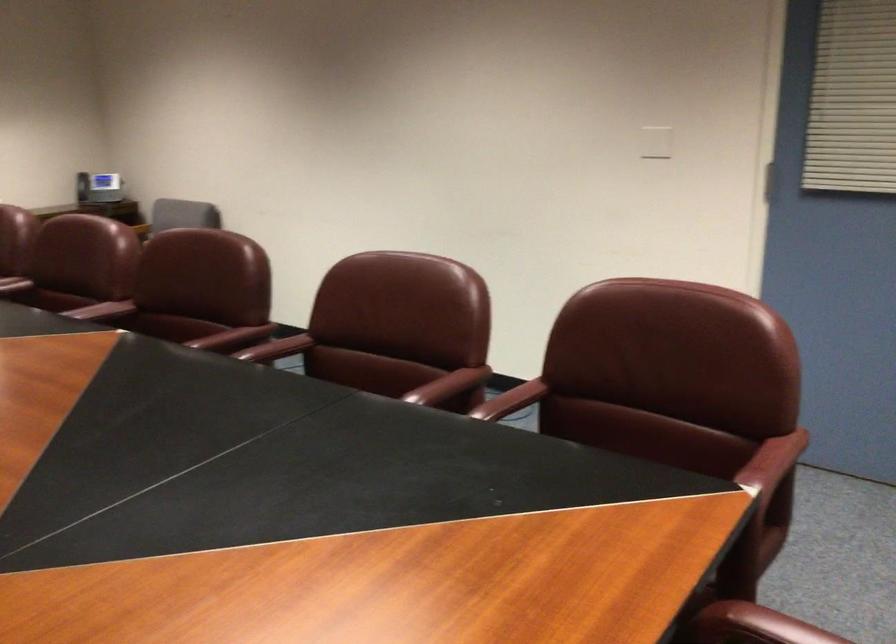
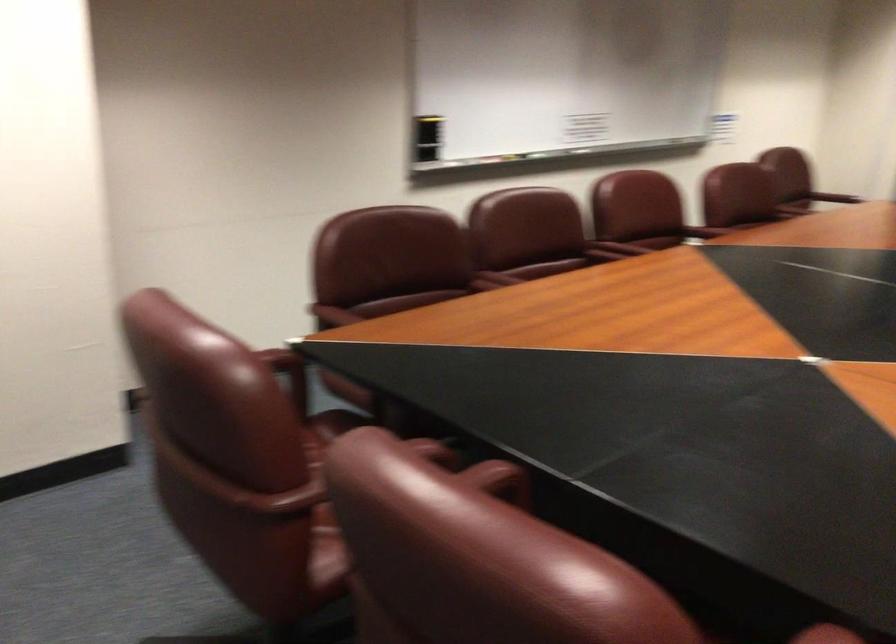
Locate, in the second image, the point that corresponds to (767,502) in the first image.

(289, 374)